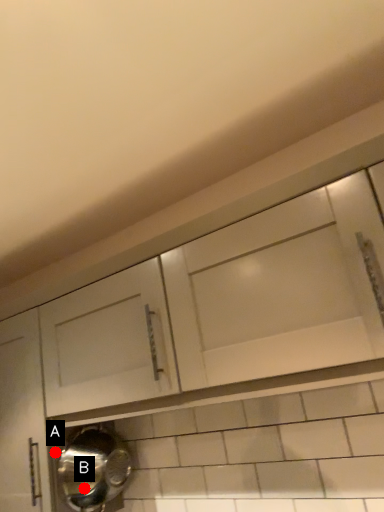
Question: Two points are circled on the image, labeled by A and B beside each circle. Which point is closer to the camera?

Choices:
 (A) A is closer
 (B) B is closer

Answer: (B)